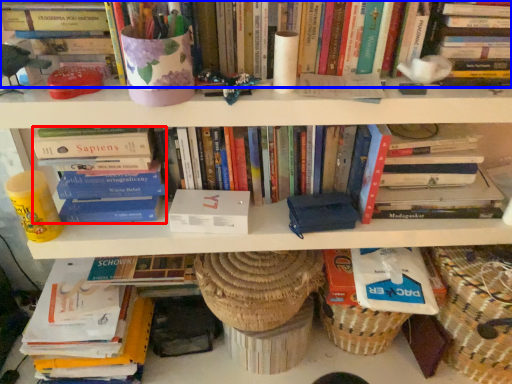
Question: Which object is further to the camera taking this photo, book (highlighted by a red box) or book (highlighted by a blue box)?

Choices:
 (A) book
 (B) book

Answer: (A)